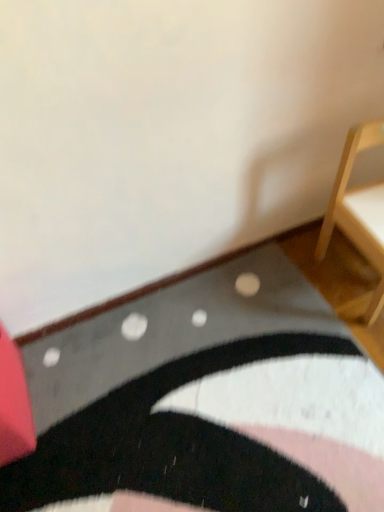
Question: Is rubberized red cushion at lower left, which is counted as the first furniture, starting from the left, positioned behind black textured rug at lower center?

Choices:
 (A) no
 (B) yes

Answer: (B)

Question: Can you confirm if rubberized red cushion at lower left, which is counted as the first furniture, starting from the left, is positioned to the right of black textured rug at lower center?

Choices:
 (A) yes
 (B) no

Answer: (B)

Question: From a real-world perspective, is rubberized red cushion at lower left, which appears as the second furniture when viewed from the right, located higher than black textured rug at lower center?

Choices:
 (A) yes
 (B) no

Answer: (A)

Question: Are rubberized red cushion at lower left, which appears as the second furniture when viewed from the right, and black textured rug at lower center located far from each other?

Choices:
 (A) yes
 (B) no

Answer: (B)

Question: Is rubberized red cushion at lower left, which is counted as the first furniture, starting from the left, positioned in front of black textured rug at lower center?

Choices:
 (A) no
 (B) yes

Answer: (A)

Question: From the image's perspective, relative to rubberized red cushion at lower left, which appears as the second furniture when viewed from the right, is light wood chair at right, which is the 1th furniture from right to left, above or below?

Choices:
 (A) below
 (B) above

Answer: (B)

Question: Would you say light wood chair at right, the 2th furniture when ordered from left to right, is to the left or to the right of rubberized red cushion at lower left, which is counted as the first furniture, starting from the left, in the picture?

Choices:
 (A) right
 (B) left

Answer: (A)

Question: Considering the positions of point (337, 172) and point (18, 372), is point (337, 172) closer or farther from the camera than point (18, 372)?

Choices:
 (A) closer
 (B) farther

Answer: (B)

Question: From a real-world perspective, is light wood chair at right, the 2th furniture when ordered from left to right, above or below rubberized red cushion at lower left, which is counted as the first furniture, starting from the left?

Choices:
 (A) above
 (B) below

Answer: (A)

Question: From the image's perspective, is light wood chair at right, the 2th furniture when ordered from left to right, positioned above or below black textured rug at lower center?

Choices:
 (A) above
 (B) below

Answer: (A)

Question: Looking at the image, does light wood chair at right, which is the 1th furniture from right to left, seem bigger or smaller compared to black textured rug at lower center?

Choices:
 (A) big
 (B) small

Answer: (B)

Question: In the image, is light wood chair at right, which is the 1th furniture from right to left, on the left side or the right side of black textured rug at lower center?

Choices:
 (A) left
 (B) right

Answer: (B)

Question: From a real-world perspective, relative to black textured rug at lower center, is light wood chair at right, which is the 1th furniture from right to left, vertically above or below?

Choices:
 (A) above
 (B) below

Answer: (A)

Question: In terms of height, does black textured rug at lower center look taller or shorter compared to light wood chair at right, which is the 1th furniture from right to left?

Choices:
 (A) tall
 (B) short

Answer: (B)

Question: In the image, is black textured rug at lower center positioned in front of or behind light wood chair at right, which is the 1th furniture from right to left?

Choices:
 (A) behind
 (B) front

Answer: (B)